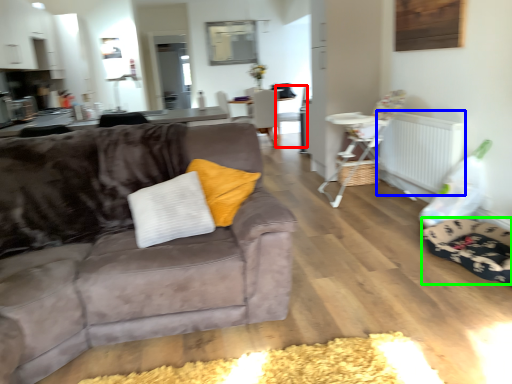
Question: Estimate the real-world distances between objects in this image. Which object is farther from armchair (highlighted by a red box), radiator (highlighted by a blue box) or dog bed (highlighted by a green box)?

Choices:
 (A) radiator
 (B) dog bed

Answer: (B)